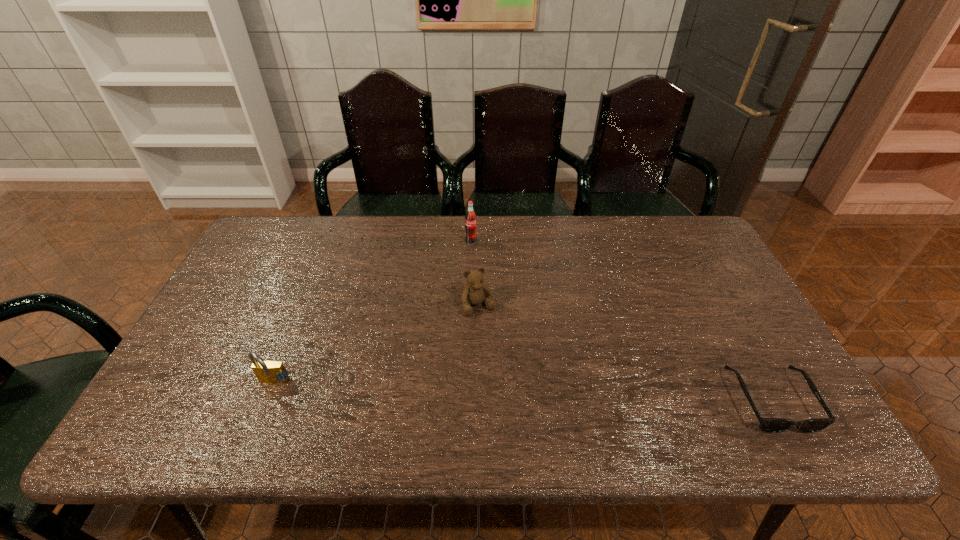
Identify the location of free point located 0.210m on the front-facing side of the third nearest object. This screenshot has height=540, width=960. (513, 379).

You are a GUI agent. You are given a task and a screenshot of the screen. Output one action in this format:
    pyautogui.click(x=<x>, y=<y>)
    Task: Click on the free space located 0.270m on the front-facing side of the third nearest object
    
    Given the screenshot: What is the action you would take?
    pyautogui.click(x=522, y=400)

The image size is (960, 540). Find the location of `object at the far edge`. object at the far edge is located at coordinates (470, 218).

Find the location of a particular element. padlock positioned at the near edge is located at coordinates (272, 372).

Locate an element on the screen. sunglasses present at the near edge is located at coordinates (768, 425).

Where is `object at the right edge`? Image resolution: width=960 pixels, height=540 pixels. object at the right edge is located at coordinates (768, 425).

This screenshot has height=540, width=960. I want to click on object located at the near right corner, so click(x=768, y=425).

Locate an element on the screen. The height and width of the screenshot is (540, 960). blank space at the far edge is located at coordinates (334, 221).

The image size is (960, 540). In the image, there is a desktop. What are the coordinates of `vacant space at the near edge` in the screenshot? It's located at (252, 391).

Locate an element on the screen. Image resolution: width=960 pixels, height=540 pixels. vacant area at the left edge of the desktop is located at coordinates click(x=252, y=288).